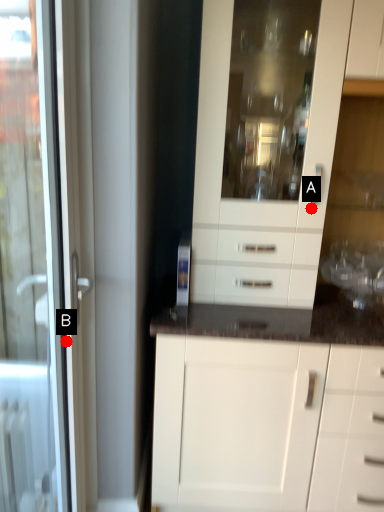
Question: Two points are circled on the image, labeled by A and B beside each circle. Among these points, which one is farthest from the camera?

Choices:
 (A) A is further
 (B) B is further

Answer: (A)